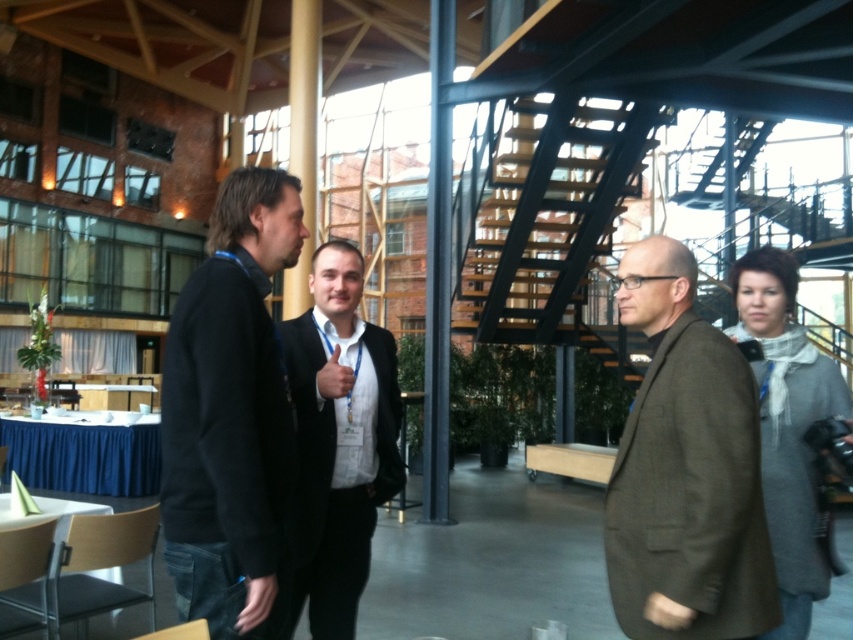
You are standing at the point marked as point (x=642, y=564) in the image. You want to walk to the staircase with a black metal railing in the background. Is the staircase located in front of you or behind you?

The staircase with a black metal railing in the background is located in front of you since you are 6.63 feet away from the point (x=642, y=564), indicating the staircase is ahead in the space.

You are a photographer positioned at the entrance of the venue. You want to capture a photo of both the dark gray sweater at center and the brown woolen jacket at center without any obstructions. Since both are at the center, which one should you focus on first to ensure the other is visible in the background?

You should focus on the dark gray sweater at center first because it is in front of the brown woolen jacket at center, so by focusing on the front object, the background object will still be visible.

You are a photographer at the event and need to capture a group photo. The two subjects are wearing the dark gray sweater at center and the black suit at center. Which clothing item is smaller in size?

The dark gray sweater at center has a smaller size compared to the black suit at center, so the dark gray sweater at center is smaller in size.